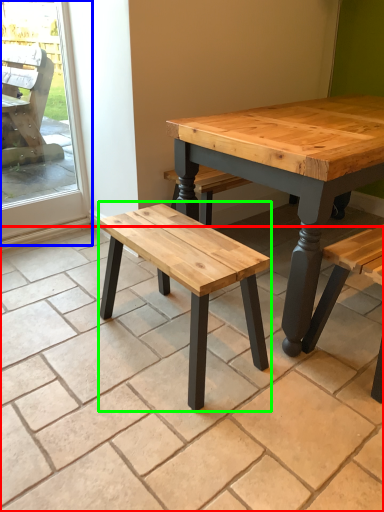
Question: Which is farther away from tile (highlighted by a red box)? screen door (highlighted by a blue box) or stool (highlighted by a green box)?

Choices:
 (A) screen door
 (B) stool

Answer: (A)